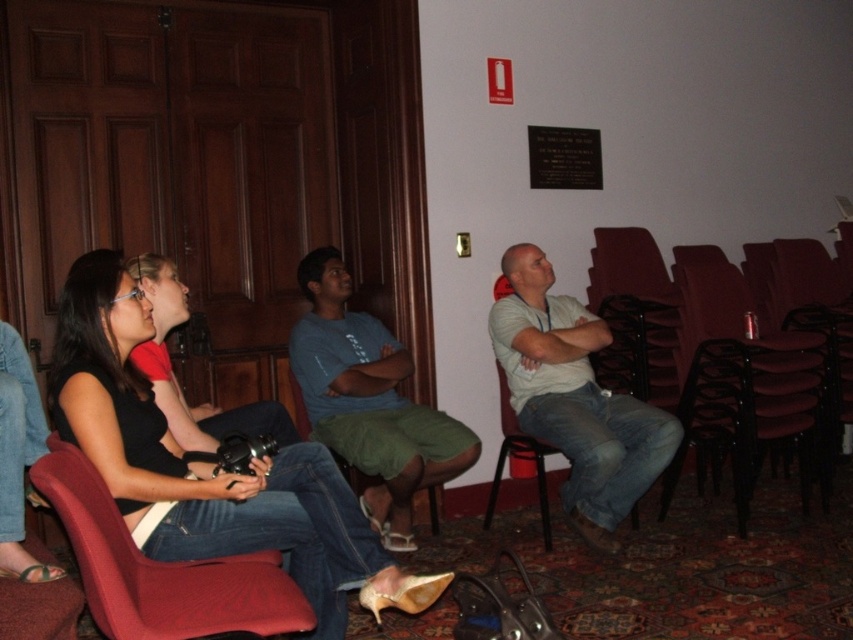
You are standing in the room and want to move from point A to point B. Point A is at coordinates point (67, 394) and point B is at coordinates point (178, 404). Since you need to walk towards point B, which direction should you move relative to point A?

To move from point A to point B, you should move backward because point A is in front of point B.

You are a photographer in the conference room. You have two matte black cameras. One is the matte black camera at lower left and the other is the matte black camera at left. Which camera is closer to the center of the room?

The matte black camera at lower left is positioned on the right side of the matte black camera at left, so the matte black camera at lower left is closer to the center of the room.

You are standing in the room and want to take a photo of the group. The camera you need is the matte black camera at lower left. Where should you look to find it?

The matte black camera at lower left is located at point [207,467], so you should look towards the lower left area of the room to find it.